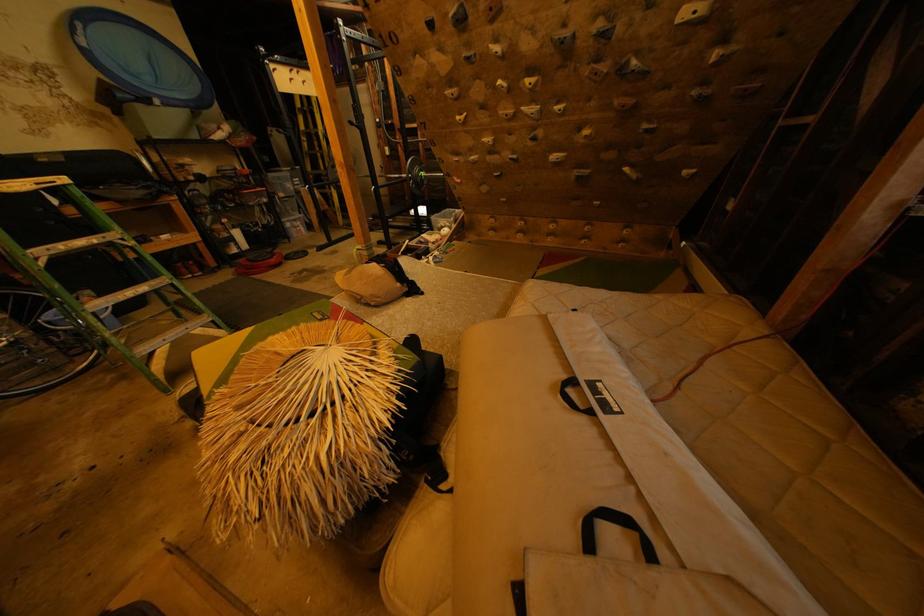
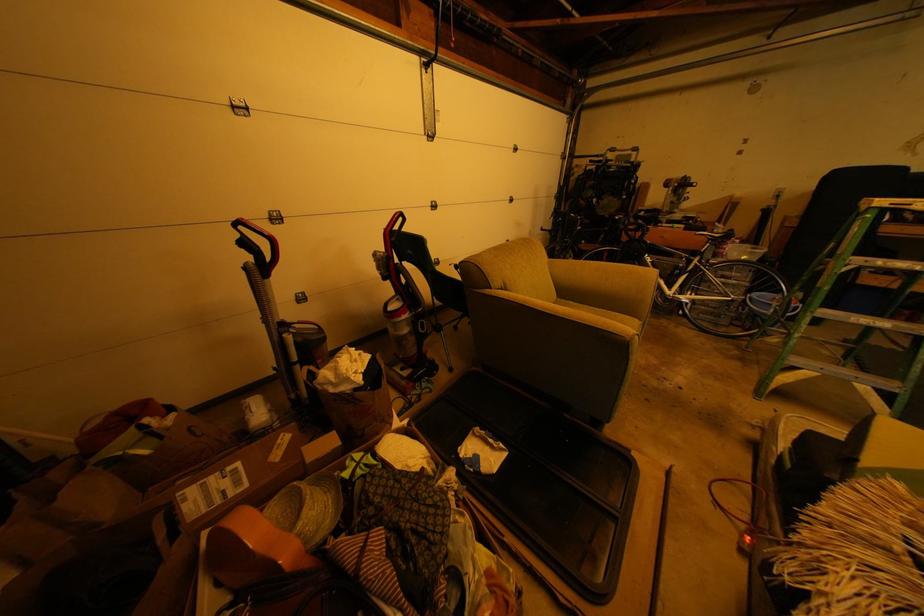
How did the camera likely rotate?

The camera rotated toward left-down.